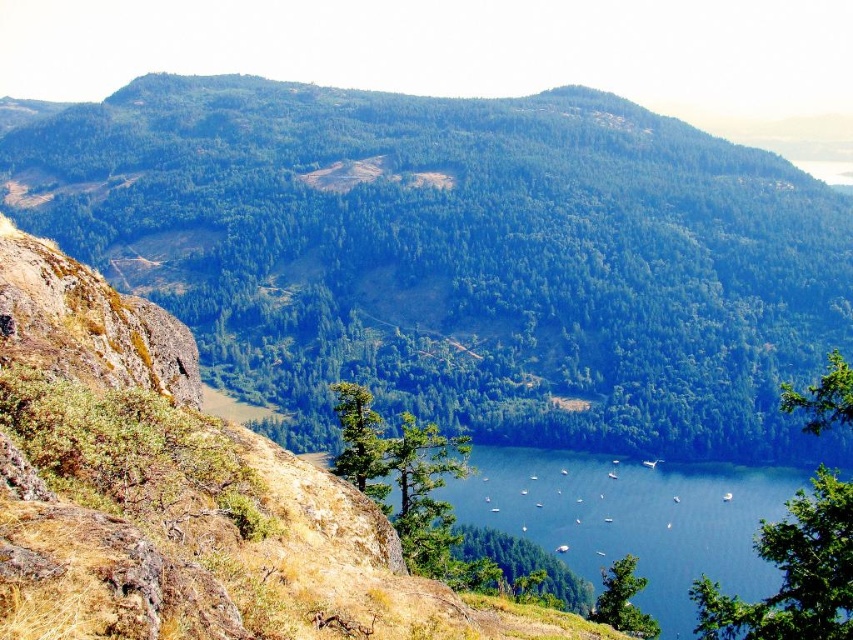
Question: Which point is farther from the camera taking this photo?

Choices:
 (A) (374, 188)
 (B) (693, 516)

Answer: (A)

Question: Does green forested mountain at center appear on the left side of blue water at center?

Choices:
 (A) yes
 (B) no

Answer: (A)

Question: Which point is closer to the camera?

Choices:
 (A) (492, 456)
 (B) (525, 426)

Answer: (A)

Question: Can you confirm if green forested mountain at center is bigger than blue water at center?

Choices:
 (A) no
 (B) yes

Answer: (B)

Question: Is green forested mountain at center further to camera compared to blue water at center?

Choices:
 (A) yes
 (B) no

Answer: (A)